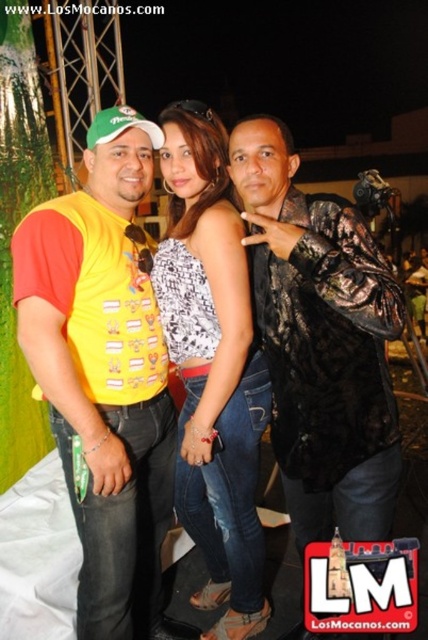
Question: Estimate the real-world distances between objects in this image. Which object is farther from the yellow printed t-shirt at left?

Choices:
 (A) white printed tank top at center
 (B) shiny black jacket at center

Answer: (B)

Question: Is yellow printed t-shirt at left positioned in front of shiny black jacket at center?

Choices:
 (A) yes
 (B) no

Answer: (B)

Question: Considering the relative positions of yellow printed t-shirt at left and white printed tank top at center in the image provided, where is yellow printed t-shirt at left located with respect to white printed tank top at center?

Choices:
 (A) above
 (B) below

Answer: (B)

Question: Which point is farther from the camera taking this photo?

Choices:
 (A) (267, 116)
 (B) (261, 397)

Answer: (B)

Question: Does yellow printed t-shirt at left have a lesser width compared to white printed tank top at center?

Choices:
 (A) yes
 (B) no

Answer: (B)

Question: Among these points, which one is farthest from the camera?

Choices:
 (A) (192, 356)
 (B) (18, 339)

Answer: (A)